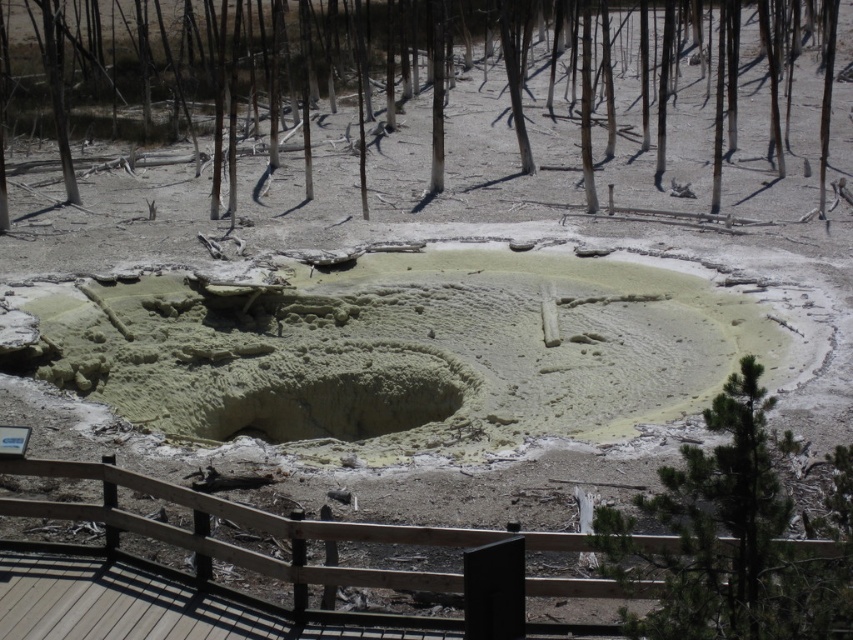
You are a park ranger assessing the health of trees in the geothermal area. You notice a gray bark tree at center and a green leafy tree at right. Which tree might be more resilient to the harsh geothermal environment?

The gray bark tree at center is bigger than the green leafy tree at right, suggesting it has survived longer in the harsh geothermal environment and may be more resilient.

You are a park ranger standing at the edge of the geothermal area. You need to locate the gray bark tree at center. Based on its 2D coordinates, where should you look relative to your current position?

The gray bark tree at center is located at coordinates 0.100 on the x axis and 0.277 on the y axis, so you should look towards the lower left direction from your current position.

You are a park ranger assessing the geothermal area. You notice the gray bark tree at center and the green leafy tree at right. Which tree is closer to the bubbling mud pool?

The gray bark tree at center is closer to the bubbling mud pool because it is positioned over the green leafy tree at right, meaning it is in front of it.